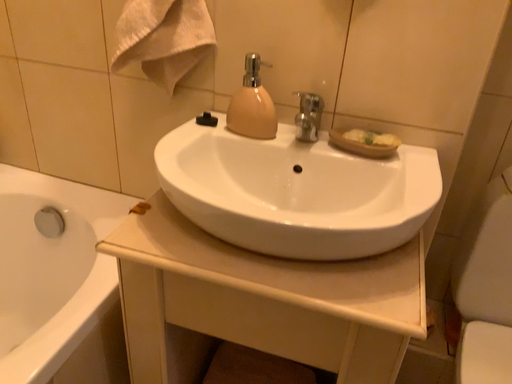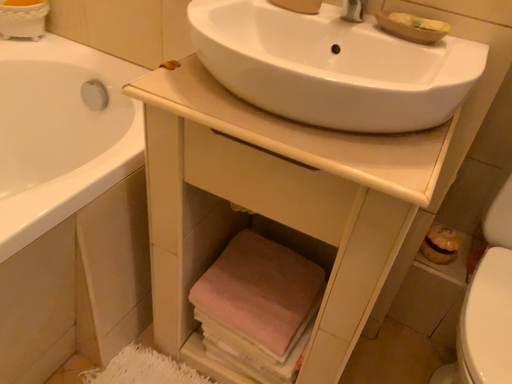
Question: How did the camera likely rotate when shooting the video?

Choices:
 (A) rotated right
 (B) rotated left

Answer: (B)